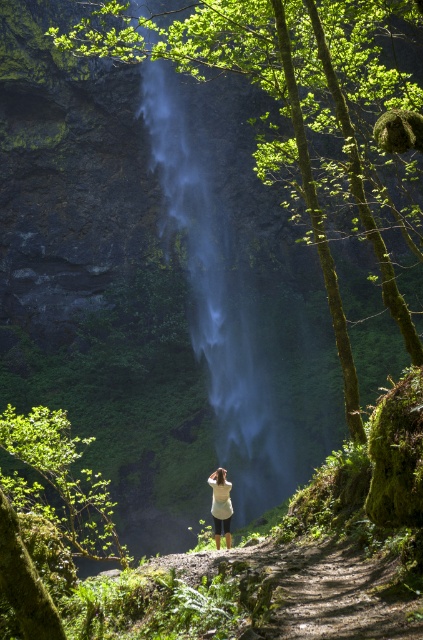
Does translucent misty waterfall at center have a lesser height compared to white matte shirt at center?

No.

Between translucent misty waterfall at center and white matte shirt at center, which one has more height?

translucent misty waterfall at center

Locate an element on the screen. Image resolution: width=423 pixels, height=640 pixels. translucent misty waterfall at center is located at coordinates (227, 275).